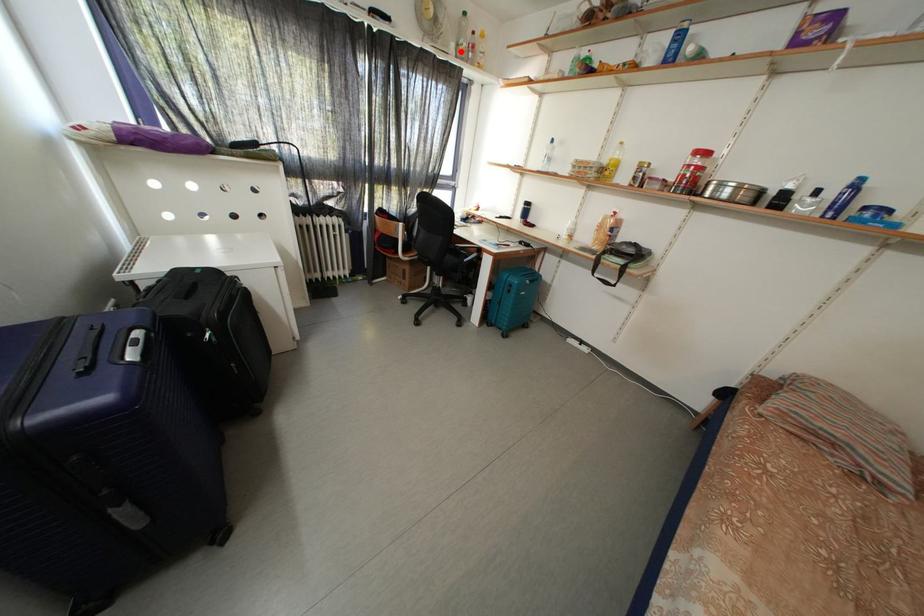
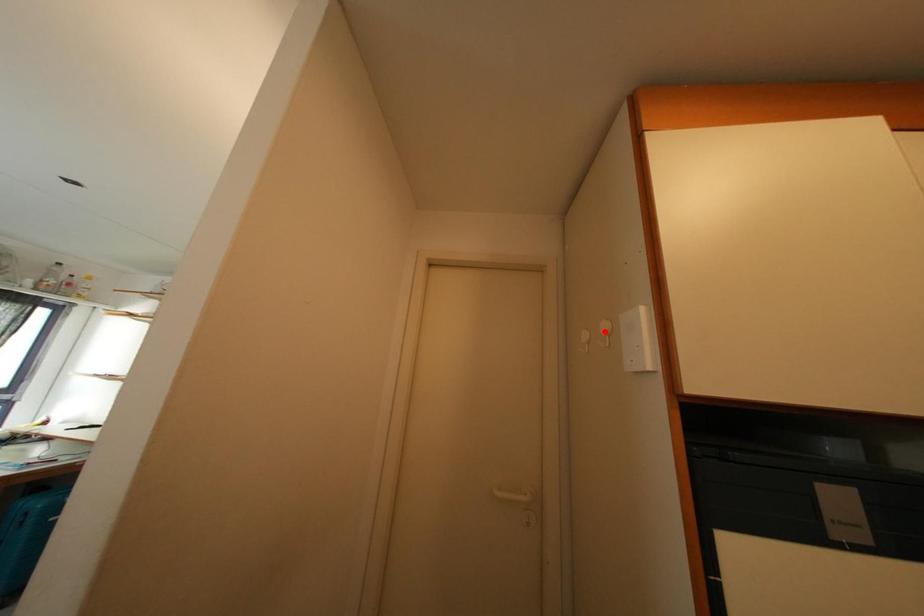
I am providing you with two images of the same scene from different viewpoints. A red point is marked on the first image and another point is marked on the second image. Is the marked point in image1 the same physical position as the marked point in image2?

No